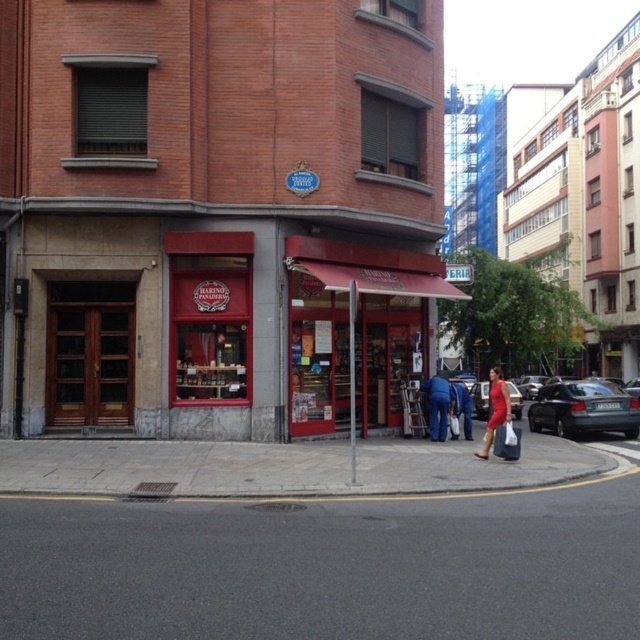
Who is higher up, gray concrete pavement at lower center or blue denim pants at lower center?

gray concrete pavement at lower center is higher up.

The width and height of the screenshot is (640, 640). What are the coordinates of `gray concrete pavement at lower center` in the screenshot? It's located at (317, 541).

Where is `gray concrete pavement at lower center`? This screenshot has height=640, width=640. gray concrete pavement at lower center is located at coordinates (317, 541).

Can you confirm if gray concrete pavement at lower center is positioned to the right of matte red dress at center?

Incorrect, gray concrete pavement at lower center is not on the right side of matte red dress at center.

In the scene shown: Does gray concrete pavement at lower center have a larger size compared to matte red dress at center?

Incorrect, gray concrete pavement at lower center is not larger than matte red dress at center.

Which is behind, point (317, 544) or point (504, 401)?

The point (504, 401) is more distant.

At what (x,y) coordinates should I click in order to perform the action: click on gray concrete pavement at lower center. Please return your answer as a coordinate pair (x, y). This screenshot has height=640, width=640. Looking at the image, I should click on (317, 541).

Who is positioned more to the left, matte red dress at center or metallic silver car at center?

From the viewer's perspective, matte red dress at center appears more on the left side.

Who is taller, matte red dress at center or metallic silver car at center?

matte red dress at center is taller.

At what (x,y) coordinates should I click in order to perform the action: click on matte red dress at center. Please return your answer as a coordinate pair (x, y). The width and height of the screenshot is (640, 640). Looking at the image, I should click on (496, 410).